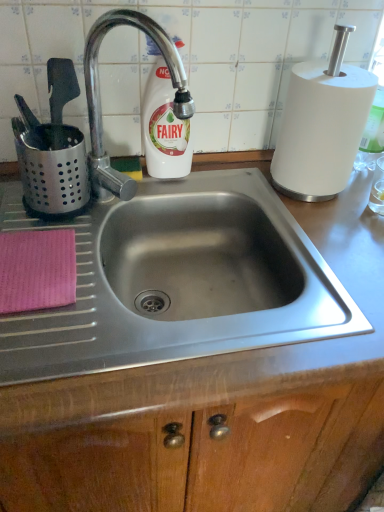
Question: Is metallic stainless steel sink at center located outside white matte paper towel at upper right?

Choices:
 (A) no
 (B) yes

Answer: (B)

Question: Considering the relative sizes of metallic stainless steel sink at center and white matte paper towel at upper right in the image provided, is metallic stainless steel sink at center thinner than white matte paper towel at upper right?

Choices:
 (A) yes
 (B) no

Answer: (B)

Question: Is metallic stainless steel sink at center aimed at white matte paper towel at upper right?

Choices:
 (A) no
 (B) yes

Answer: (A)

Question: Does metallic stainless steel sink at center appear on the right side of white matte paper towel at upper right?

Choices:
 (A) no
 (B) yes

Answer: (A)

Question: Is metallic stainless steel sink at center wider than white matte paper towel at upper right?

Choices:
 (A) no
 (B) yes

Answer: (B)

Question: From a real-world perspective, relative to metallic stainless steel sink at center, is white glossy bottle at upper center vertically above or below?

Choices:
 (A) above
 (B) below

Answer: (A)

Question: Considering the positions of point (152, 105) and point (125, 439), is point (152, 105) closer or farther from the camera than point (125, 439)?

Choices:
 (A) farther
 (B) closer

Answer: (A)

Question: Based on their positions, is white glossy bottle at upper center located to the left or right of metallic stainless steel sink at center?

Choices:
 (A) left
 (B) right

Answer: (A)

Question: Considering the positions of white glossy bottle at upper center and metallic stainless steel sink at center in the image, is white glossy bottle at upper center taller or shorter than metallic stainless steel sink at center?

Choices:
 (A) tall
 (B) short

Answer: (B)

Question: Do you think polished metal faucet at upper left is within metallic stainless steel sink at center, or outside of it?

Choices:
 (A) outside
 (B) inside

Answer: (A)

Question: Based on their positions, is polished metal faucet at upper left located to the left or right of metallic stainless steel sink at center?

Choices:
 (A) right
 (B) left

Answer: (B)

Question: From the image's perspective, relative to metallic stainless steel sink at center, is polished metal faucet at upper left above or below?

Choices:
 (A) below
 (B) above

Answer: (B)

Question: Considering the positions of polished metal faucet at upper left and metallic stainless steel sink at center in the image, is polished metal faucet at upper left wider or thinner than metallic stainless steel sink at center?

Choices:
 (A) thin
 (B) wide

Answer: (A)

Question: In terms of size, does white matte paper towel at upper right appear bigger or smaller than pink woven cloth at lower left?

Choices:
 (A) big
 (B) small

Answer: (A)

Question: Do you think white matte paper towel at upper right is within pink woven cloth at lower left, or outside of it?

Choices:
 (A) inside
 (B) outside

Answer: (B)